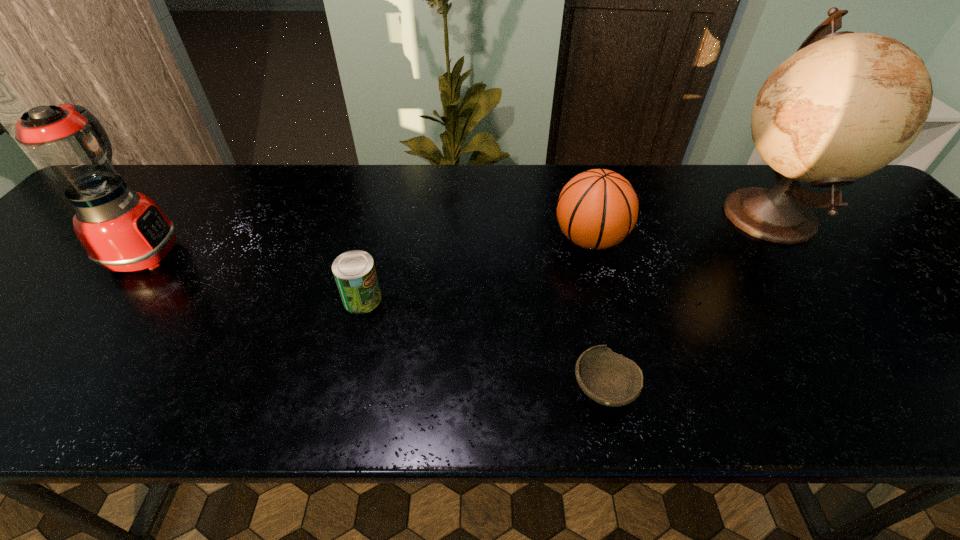
Locate an element on the screen. The width and height of the screenshot is (960, 540). free space that is in between the fourth shortest object and the third tallest object is located at coordinates (368, 246).

Locate an element on the screen. The width and height of the screenshot is (960, 540). vacant area that lies between the globe and the bowl is located at coordinates (685, 301).

Find the location of a particular element. empty location between the basketball and the fourth shortest object is located at coordinates (368, 246).

The height and width of the screenshot is (540, 960). I want to click on unoccupied area between the food processor and the bowl, so click(375, 321).

Find the location of a particular element. This screenshot has height=540, width=960. free space between the fourth object from right to left and the basketball is located at coordinates (476, 269).

You are a GUI agent. You are given a task and a screenshot of the screen. Output one action in this format:
    pyautogui.click(x=<x>, y=<y>)
    Task: Click on the object identified as the third closest to the second tallest object
    This screenshot has height=540, width=960.
    Given the screenshot: What is the action you would take?
    pyautogui.click(x=608, y=378)

Identify the location of object that ranks as the second closest to the second nearest object. (608, 378).

In order to click on free spot that satisfies the following two spatial constraints: 1. on the controls of the leftmost object; 2. on the right side of the fourth tallest object in this screenshot , I will do `click(110, 299)`.

I want to click on free region that satisfies the following two spatial constraints: 1. on the back side of the third shortest object; 2. on the left side of the nearest object, so pos(571,240).

Identify the location of free space that satisfies the following two spatial constraints: 1. on the controls of the second shortest object; 2. on the left side of the food processor. (110, 299).